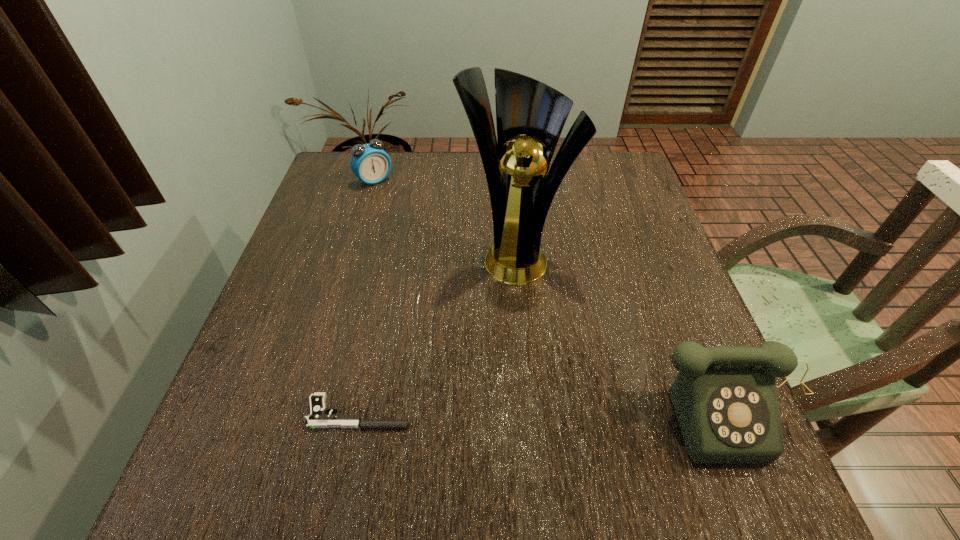
The width and height of the screenshot is (960, 540). Find the location of `the shortest object`. the shortest object is located at coordinates (318, 418).

Locate an element on the screen. Image resolution: width=960 pixels, height=540 pixels. the second tallest object is located at coordinates (725, 400).

This screenshot has height=540, width=960. What are the coordinates of `the rightmost object` in the screenshot? It's located at (725, 400).

Where is `the tallest object`? the tallest object is located at coordinates (530, 115).

At what (x,y) coordinates should I click in order to perform the action: click on award. Please return your answer as a coordinate pair (x, y). Looking at the image, I should click on (530, 115).

Locate an element on the screen. the farthest object is located at coordinates (370, 163).

Where is `the second shortest object`? The image size is (960, 540). the second shortest object is located at coordinates (370, 163).

Find the location of `vacant space situated 0.130m on the front-facing side of the shortest object`. vacant space situated 0.130m on the front-facing side of the shortest object is located at coordinates (485, 413).

The height and width of the screenshot is (540, 960). I want to click on vacant area situated 0.330m at the front of the tallest object, where the globe is visible, so click(502, 424).

At what (x,y) coordinates should I click in order to perform the action: click on free space located 0.320m at the front of the tallest object, where the globe is visible. Please return your answer as a coordinate pair (x, y). Looking at the image, I should click on (502, 419).